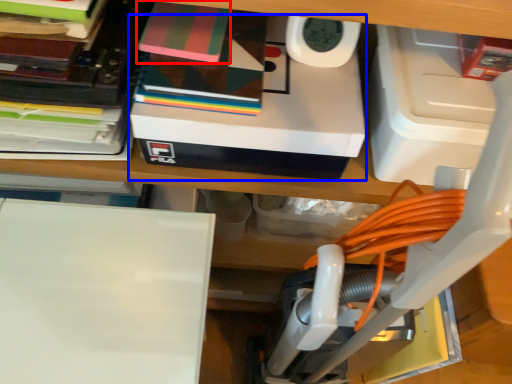
Question: Which object appears farthest to the camera in this image, paperback book (highlighted by a red box) or box (highlighted by a blue box)?

Choices:
 (A) paperback book
 (B) box

Answer: (A)